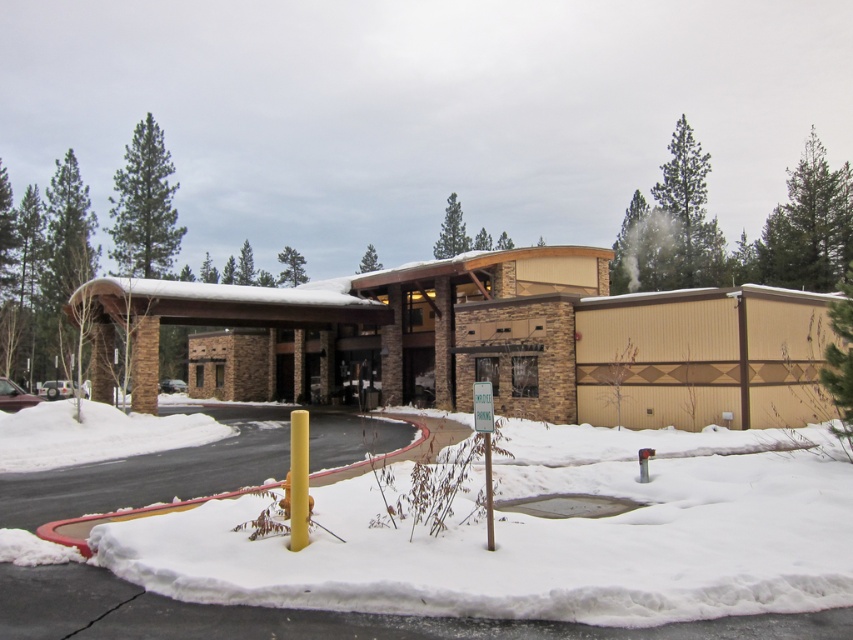
Question: Where is white fluffy snow at lower left located in relation to beige wood hotel at center in the image?

Choices:
 (A) above
 (B) below

Answer: (B)

Question: Does white fluffy snow at lower left appear under beige wood hotel at center?

Choices:
 (A) no
 (B) yes

Answer: (B)

Question: Which object appears farthest from the camera in this image?

Choices:
 (A) white fluffy snow at lower left
 (B) beige wood hotel at center

Answer: (B)

Question: Does white fluffy snow at lower left lie in front of beige wood hotel at center?

Choices:
 (A) no
 (B) yes

Answer: (B)

Question: Which of the following is the farthest from the observer?

Choices:
 (A) white fluffy snow at lower left
 (B) beige wood hotel at center

Answer: (B)